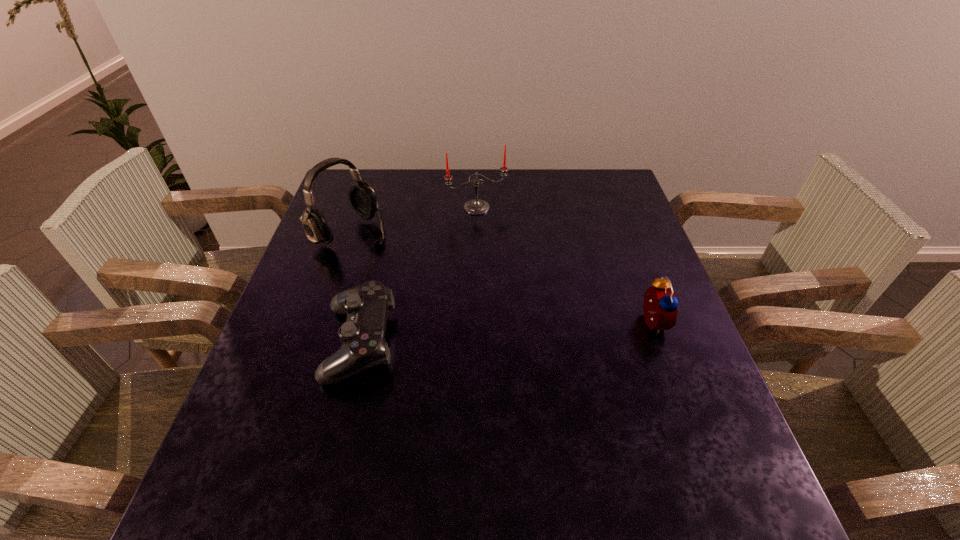
Identify the location of vacant space located on the front-facing side of the third object from left to right. (531, 300).

I want to click on free region located 0.180m on the front-facing side of the third object from left to right, so click(506, 253).

Locate an element on the screen. This screenshot has width=960, height=540. object situated at the far edge is located at coordinates (476, 206).

Where is `control that is positioned at the left edge`? Image resolution: width=960 pixels, height=540 pixels. control that is positioned at the left edge is located at coordinates (363, 345).

Locate an element on the screen. This screenshot has height=540, width=960. headset situated at the left edge is located at coordinates (362, 197).

Locate an element on the screen. This screenshot has width=960, height=540. object that is at the right edge is located at coordinates (660, 306).

Locate an element on the screen. The image size is (960, 540). free region at the far edge of the desktop is located at coordinates (500, 171).

Identify the location of vacant area at the near edge. (506, 435).

In the image, there is a desktop. Identify the location of vacant space at the left edge. The width and height of the screenshot is (960, 540). (320, 254).

This screenshot has width=960, height=540. What are the coordinates of `free space at the right edge of the desktop` in the screenshot? It's located at click(639, 366).